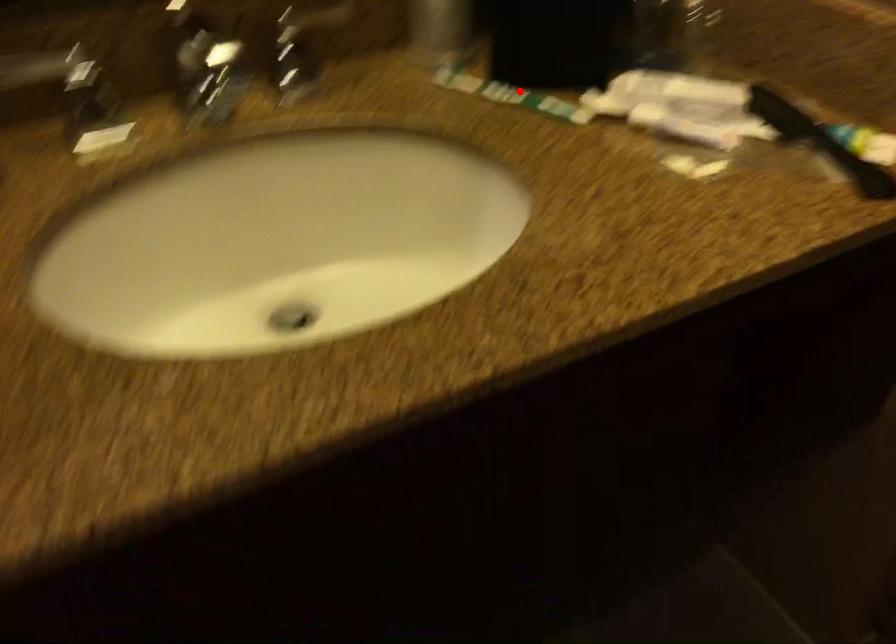
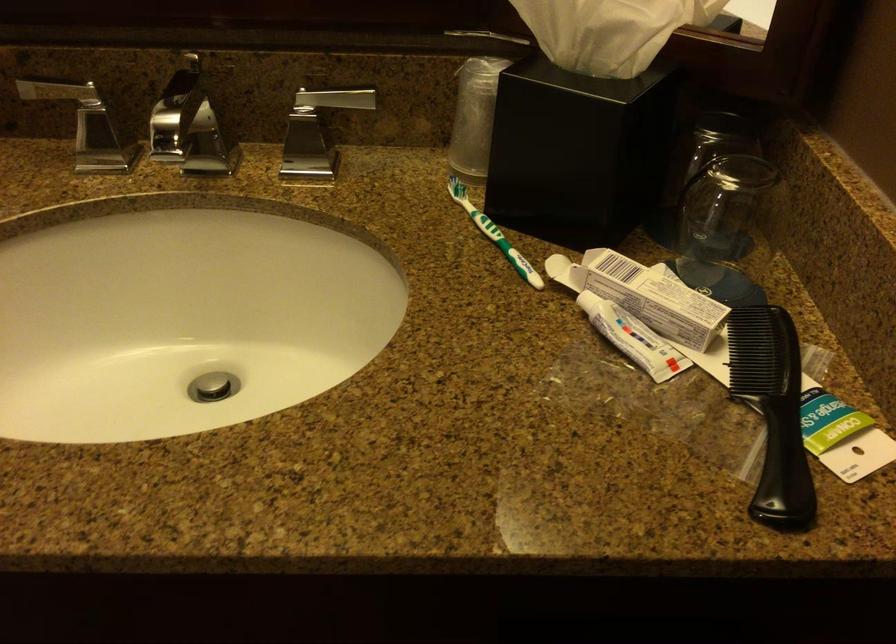
Question: I am providing you with two images of the same scene from different viewpoints. A red point is shown in image1. For the corresponding object point in image2, is it positioned nearer or farther from the camera?

Choices:
 (A) Nearer
 (B) Farther

Answer: (A)